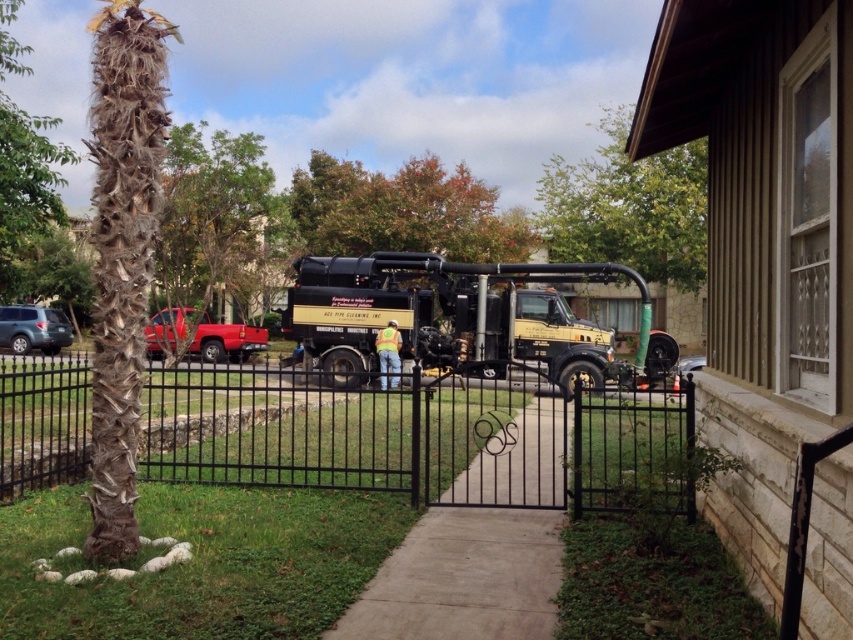
You are a delivery driver approaching the house through the open gate. You need to park your vehicle, which is the same size as the satin silver suv at lower left, in a spot that is not blocked by the brown rough bark tree at upper left. Is there a suitable parking spot available?

The brown rough bark tree at upper left is above the satin silver suv at lower left, so the tree is positioned higher up and might block the parking area. However, since the suv is already parked at lower left without obstruction, there should be a suitable spot available as long as you park in the same area as the satin silver suv at lower left.